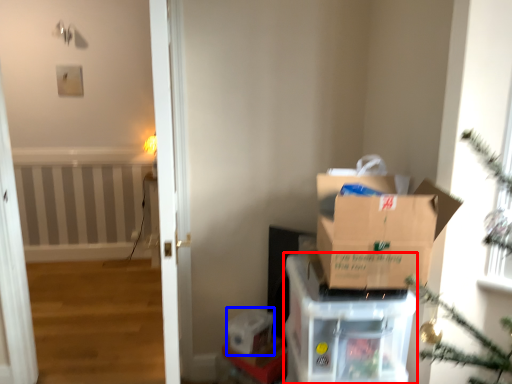
Question: Which point is closer to the camera, cardboard box (highlighted by a red box) or storage box (highlighted by a blue box)?

Choices:
 (A) cardboard box
 (B) storage box

Answer: (A)